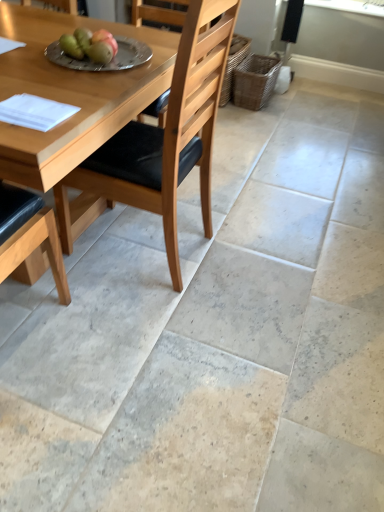
I want to click on free space to the back side of white paper at lower left, so click(x=64, y=92).